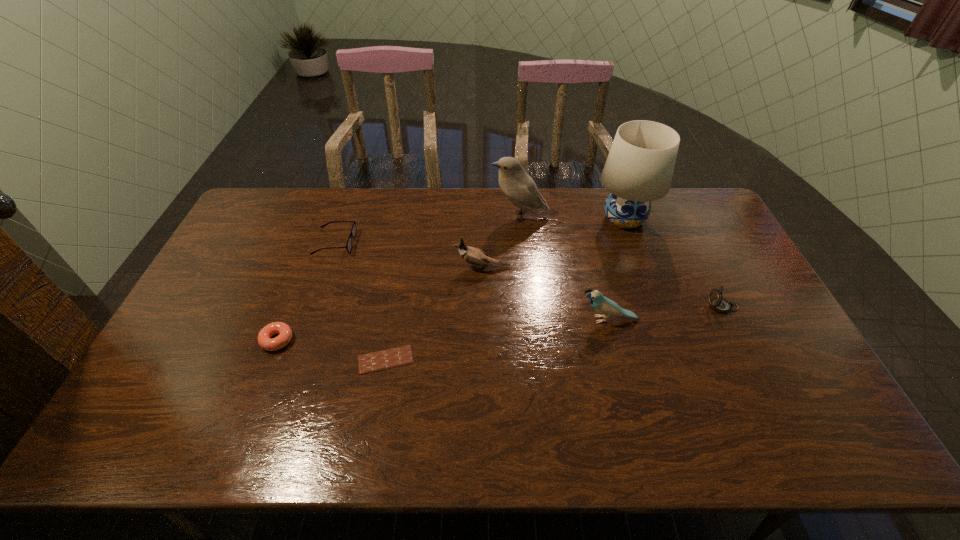
Choose which bird is the third nearest neighbor to the fifth tallest object. Please provide its 2D coordinates. Your answer should be formatted as a tuple, i.e. [(x, y)], where the tuple contains the x and y coordinates of a point satisfying the conditions above.

[(474, 256)]

Image resolution: width=960 pixels, height=540 pixels. Find the location of `vacant space that satisfies the following two spatial constraints: 1. on the front-facing side of the lampshade; 2. at the face of the nearest bird`. vacant space that satisfies the following two spatial constraints: 1. on the front-facing side of the lampshade; 2. at the face of the nearest bird is located at coordinates (660, 320).

Find the location of a particular element. vacant space that satisfies the following two spatial constraints: 1. on the front-facing side of the tallest object; 2. at the face of the nearest bird is located at coordinates (660, 320).

Where is `vacant space that satisfies the following two spatial constraints: 1. on the front-facing side of the sixth tallest object; 2. on the back side of the shortest object`? Image resolution: width=960 pixels, height=540 pixels. vacant space that satisfies the following two spatial constraints: 1. on the front-facing side of the sixth tallest object; 2. on the back side of the shortest object is located at coordinates (295, 360).